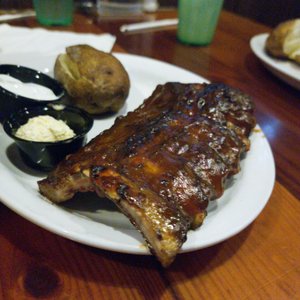
Identify the location of white plate. This screenshot has width=300, height=300. 255,188, 268,61.